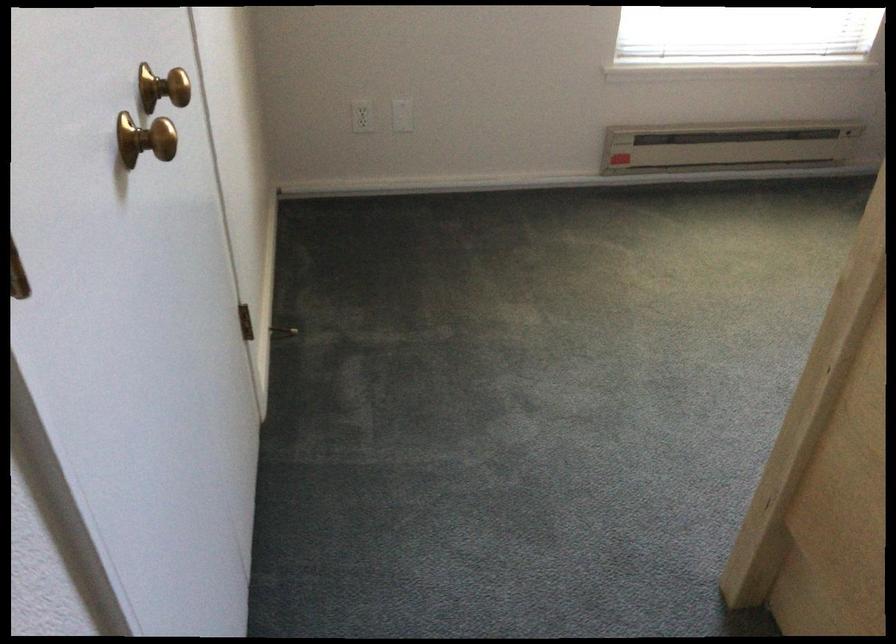
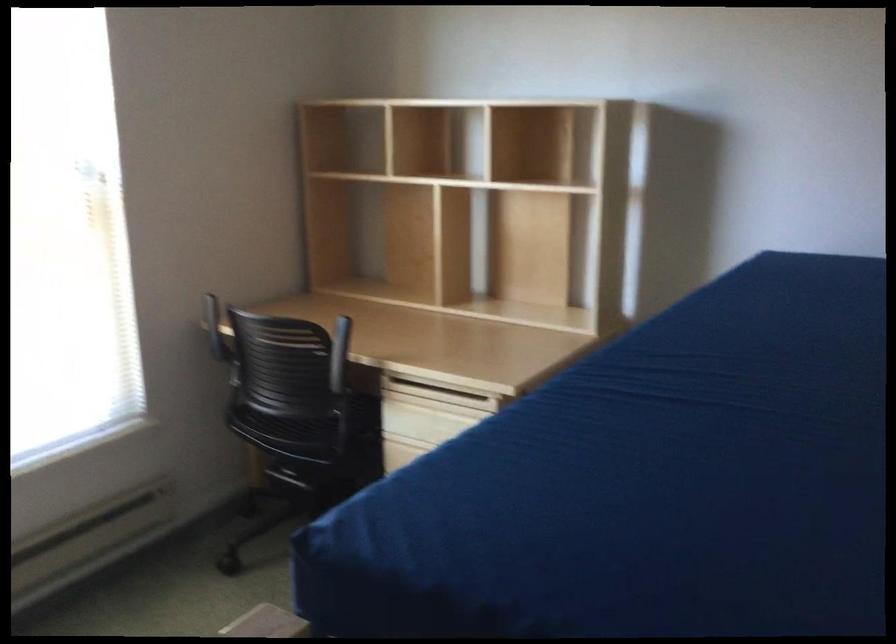
Question: How did the camera likely rotate?

Choices:
 (A) Left
 (B) Right
 (C) Up
 (D) Down

Answer: (B)